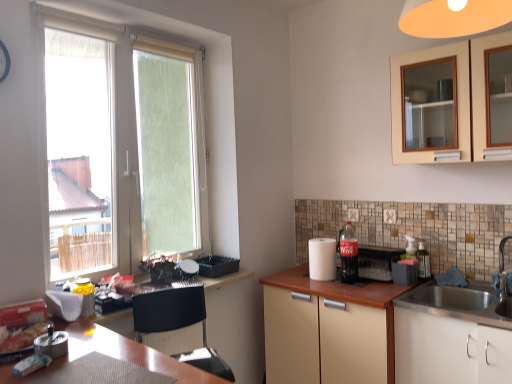
Consider the image. Measure the distance between point (327, 334) and camera.

Point (327, 334) is 7.66 feet from camera.

The image size is (512, 384). Describe the element at coordinates (384, 332) in the screenshot. I see `beige matte cabinet at center, the 2th cabinetry positioned from the right` at that location.

What is the approximate height of white plastic window at left?

white plastic window at left is 1.31 meters tall.

The width and height of the screenshot is (512, 384). In order to click on white glossy sink at lower right, marked as the first cabinetry in a right-to-left arrangement in this screenshot , I will do point(449,350).

This screenshot has width=512, height=384. What do you see at coordinates (349, 254) in the screenshot? I see `red glass coca-cola bottle at center-right` at bounding box center [349, 254].

In order to click on beige matte cabinet at center, the 1th cabinetry positioned from the left in this screenshot , I will do `click(384, 332)`.

Who is taller, black plastic soda at center, which appears as the first appliance when viewed from the right, or black plastic chair at lower left?

With more height is black plastic chair at lower left.

From the image's perspective, which is below, black plastic soda at center, which appears as the first appliance when viewed from the right, or black plastic chair at lower left?

black plastic chair at lower left, from the image's perspective.

Is black plastic soda at center, marked as the 2th appliance in a left-to-right arrangement, bigger than black plastic chair at lower left?

No.

From a real-world perspective, is black plastic soda at center, marked as the 2th appliance in a left-to-right arrangement, below black plastic chair at lower left?

No.

Considering the sizes of objects white plastic window at left and beige matte cabinet at center, the 2th cabinetry positioned from the right, in the image provided, who is wider, white plastic window at left or beige matte cabinet at center, the 2th cabinetry positioned from the right,?

With larger width is beige matte cabinet at center, the 2th cabinetry positioned from the right.

From the image's perspective, is white plastic window at left positioned above or below beige matte cabinet at center, the 1th cabinetry positioned from the left?

white plastic window at left is situated higher than beige matte cabinet at center, the 1th cabinetry positioned from the left, in the image.

Is white paper towel at center, which appears as the second appliance when viewed from the right, at the left side of transparent plastic bottle at right?

Yes, white paper towel at center, which appears as the second appliance when viewed from the right, is to the left of transparent plastic bottle at right.

Is white paper towel at center, which appears as the 1th appliance when viewed from the left, facing away from transparent plastic bottle at right?

white paper towel at center, which appears as the 1th appliance when viewed from the left, is not turned away from transparent plastic bottle at right.

From the image's perspective, which is above, white paper towel at center, which appears as the second appliance when viewed from the right, or transparent plastic bottle at right?

white paper towel at center, which appears as the second appliance when viewed from the right, from the image's perspective.

Are white paper towel at center, which appears as the second appliance when viewed from the right, and transparent plastic bottle at right making contact?

No, white paper towel at center, which appears as the second appliance when viewed from the right, is not making contact with transparent plastic bottle at right.

How different are the orientations of white paper towel at center, which appears as the 1th appliance when viewed from the left, and wooden at left in degrees?

90 degrees separate the facing orientations of white paper towel at center, which appears as the 1th appliance when viewed from the left, and wooden at left.

Would you say white paper towel at center, which appears as the 1th appliance when viewed from the left, is outside wooden at left?

That's correct, white paper towel at center, which appears as the 1th appliance when viewed from the left, is outside of wooden at left.

How far apart are white paper towel at center, which appears as the second appliance when viewed from the right, and wooden at left?

white paper towel at center, which appears as the second appliance when viewed from the right, is 1.22 meters from wooden at left.

Is white paper towel at center, which appears as the 1th appliance when viewed from the left, bigger than wooden at left?

Actually, white paper towel at center, which appears as the 1th appliance when viewed from the left, might be smaller than wooden at left.

Between black plastic chair at lower left and black plastic soda at center, which appears as the first appliance when viewed from the right, which one appears on the right side from the viewer's perspective?

From the viewer's perspective, black plastic soda at center, which appears as the first appliance when viewed from the right, appears more on the right side.

Considering the relative sizes of black plastic chair at lower left and black plastic soda at center, which appears as the first appliance when viewed from the right, in the image provided, is black plastic chair at lower left smaller than black plastic soda at center, which appears as the first appliance when viewed from the right,?

Actually, black plastic chair at lower left might be larger than black plastic soda at center, which appears as the first appliance when viewed from the right.

From a real-world perspective, is black plastic chair at lower left above or below black plastic soda at center, marked as the 2th appliance in a left-to-right arrangement?

black plastic chair at lower left is situated lower than black plastic soda at center, marked as the 2th appliance in a left-to-right arrangement, in the real world.

Between transparent plastic bottle at right and red glass coca-cola bottle at center-right, which one has less height?

transparent plastic bottle at right is shorter.

Which of these two, transparent plastic bottle at right or red glass coca-cola bottle at center-right, is smaller?

With smaller size is transparent plastic bottle at right.

Between transparent plastic bottle at right and red glass coca-cola bottle at center-right, which one has larger width?

With larger width is red glass coca-cola bottle at center-right.

Where is `bottle behind the red glass coca-cola bottle at center-right`? bottle behind the red glass coca-cola bottle at center-right is located at coordinates (423, 261).

Which object is positioned more to the right, beige matte cabinet at center, the 2th cabinetry positioned from the right, or transparent plastic bottle at right?

transparent plastic bottle at right.

How many degrees apart are the facing directions of beige matte cabinet at center, the 1th cabinetry positioned from the left, and transparent plastic bottle at right?

They differ by 0.000187 degrees in their facing directions.

Which point is more forward, [411,319] or [417,256]?

The point [411,319] is more forward.

Does beige matte cabinet at center, the 2th cabinetry positioned from the right, turn towards transparent plastic bottle at right?

No.

Where is `the 1st appliance behind the black plastic chair at lower left, counting from the anchor's position`? This screenshot has width=512, height=384. the 1st appliance behind the black plastic chair at lower left, counting from the anchor's position is located at coordinates (377, 261).

Find the location of a particular element. This screenshot has height=384, width=512. the 1st cabinetry counting from the right of the white plastic window at left is located at coordinates (384, 332).

From the picture: Based on their spatial positions, is black plastic soda at center, marked as the 2th appliance in a left-to-right arrangement, or white plastic window at left further from white glossy sink at lower right, marked as the second cabinetry in a left-to-right arrangement?

Among the two, white plastic window at left is located further to white glossy sink at lower right, marked as the second cabinetry in a left-to-right arrangement.

Looking at the image, which one is located closer to red glass coca-cola bottle at center-right, black plastic chair at lower left or beige matte cabinet at center, the 2th cabinetry positioned from the right?

beige matte cabinet at center, the 2th cabinetry positioned from the right, is closer to red glass coca-cola bottle at center-right.

From the image, which object appears to be nearer to white glossy sink at lower right, marked as the second cabinetry in a left-to-right arrangement, black plastic soda at center, marked as the 2th appliance in a left-to-right arrangement, or black plastic chair at lower left?

Among the two, black plastic soda at center, marked as the 2th appliance in a left-to-right arrangement, is located nearer to white glossy sink at lower right, marked as the second cabinetry in a left-to-right arrangement.

Which object lies nearer to the anchor point white glossy sink at lower right, marked as the first cabinetry in a right-to-left arrangement, white plastic window at left or wooden at left?

wooden at left lies closer to white glossy sink at lower right, marked as the first cabinetry in a right-to-left arrangement, than the other object.

Which object lies further to the anchor point white glossy sink at lower right, marked as the second cabinetry in a left-to-right arrangement, beige matte cabinet at center, the 2th cabinetry positioned from the right, or white paper towel at center, which appears as the second appliance when viewed from the right?

→ Among the two, white paper towel at center, which appears as the second appliance when viewed from the right, is located further to white glossy sink at lower right, marked as the second cabinetry in a left-to-right arrangement.

Looking at the image, which one is located further to black plastic soda at center, which appears as the first appliance when viewed from the right, transparent plastic bottle at right or white plastic window at left?

Based on the image, white plastic window at left appears to be further to black plastic soda at center, which appears as the first appliance when viewed from the right.

Consider the image. From the image, which object appears to be nearer to black plastic chair at lower left, beige matte cabinet at center, the 2th cabinetry positioned from the right, or red glass coca-cola bottle at center-right?

Among the two, beige matte cabinet at center, the 2th cabinetry positioned from the right, is located nearer to black plastic chair at lower left.

Based on their spatial positions, is black plastic chair at lower left or white paper towel at center, which appears as the second appliance when viewed from the right, closer to transparent plastic bottle at right?

Based on the image, white paper towel at center, which appears as the second appliance when viewed from the right, appears to be nearer to transparent plastic bottle at right.

The height and width of the screenshot is (384, 512). I want to click on chair between white plastic window at left and white paper towel at center, which appears as the 1th appliance when viewed from the left, so click(178, 324).

This screenshot has width=512, height=384. I want to click on cabinetry between white glossy sink at lower right, marked as the second cabinetry in a left-to-right arrangement, and black plastic soda at center, marked as the 2th appliance in a left-to-right arrangement, along the z-axis, so click(384, 332).

Locate an element on the screen. The width and height of the screenshot is (512, 384). window between wooden at left and red glass coca-cola bottle at center-right in the front-back direction is located at coordinates (112, 152).

Identify the location of appliance between white plastic window at left and red glass coca-cola bottle at center-right. The image size is (512, 384). (322, 259).